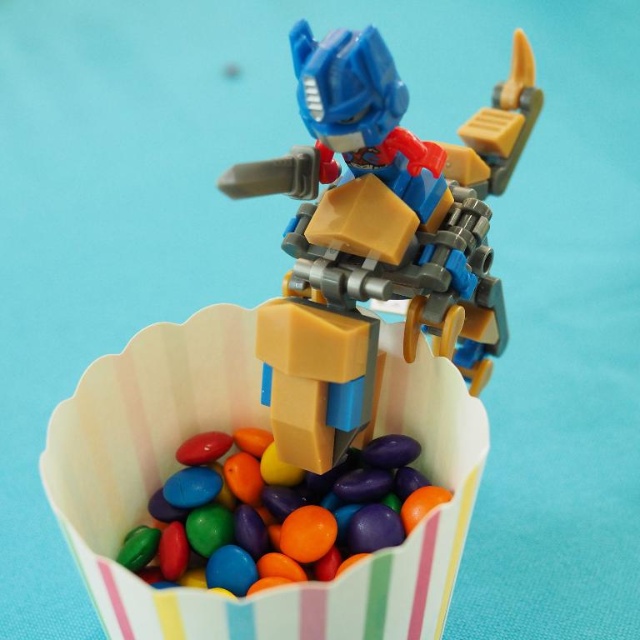
What object is located at the coordinates point (378, 236) in the image?

The point (378, 236) corresponds to the matte plastic robot at center.

You are trying to place a sticker on the matte plastic robot at center without covering any of the glossy plastic candy at center. Based on their positions, which side of the robot should you avoid to prevent overlapping with the candy?

The glossy plastic candy at center is on the left side of the matte plastic robot at center. To avoid overlapping, you should avoid placing the sticker on the left side of the matte plastic robot at center.

You are a child trying to grab the glossy plastic candy at center from the cupcake liner. The robot is in the way. Can you move the matte plastic robot at center out of the way to reach the candy without touching it? Explain why based on the distance between them.

The distance between the matte plastic robot at center and the glossy plastic candy at center is 19.56 centimeters. Since the robot is already 19.56 cm away from the candy, you can easily move the matte plastic robot at center aside to reach the candy without touching it because there is enough space between them.